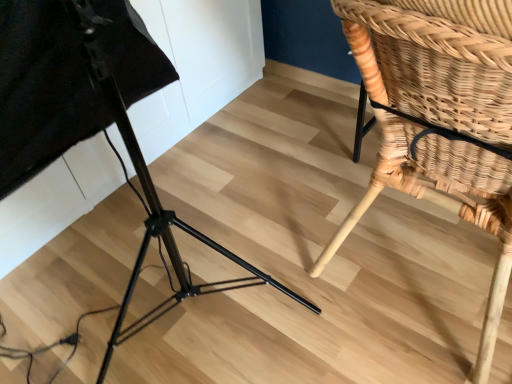
Locate an element on the screen. The height and width of the screenshot is (384, 512). free area in between black metal tripod at lower left and woven wood chair at lower right is located at coordinates [293, 211].